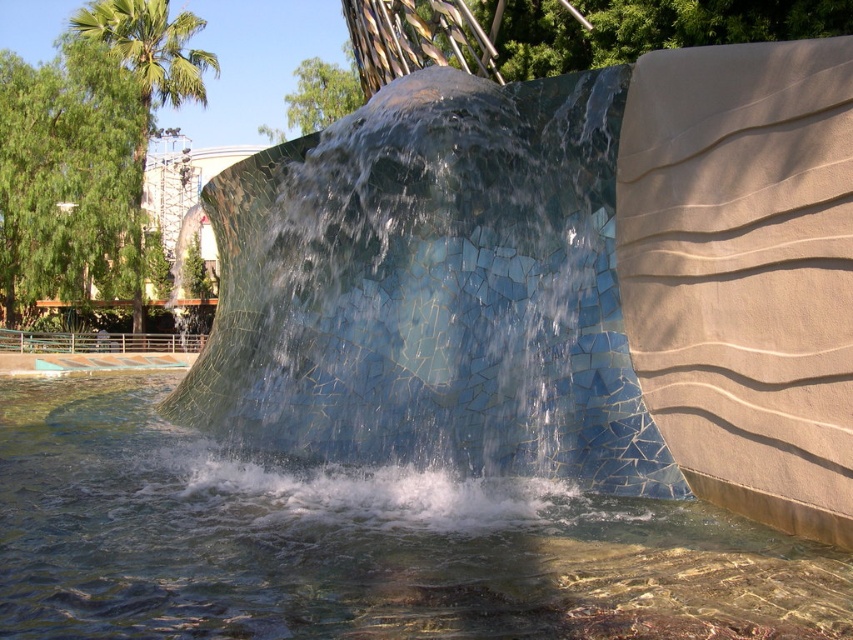
You are standing at the roller coaster area and looking towards the water feature. There are two points marked in the image. Which point is closer to you, point (254, 381) or point (793, 628)?

Point (793, 628) is closer to you because point (254, 381) is behind it.

In the scene shown: You are standing in front of the water feature and want to know if the translucent glass water at center could be wider than the green leafy palm tree at upper left. Can you confirm this based on the scene?

The translucent glass water at center might be wider than green leafy palm tree at upper left according to the description.

You are standing at the point with coordinates (432, 289) in the water feature scene. What object is located exactly at your current position?

The blue mosaic wall at center is located exactly at the point with coordinates (432, 289).